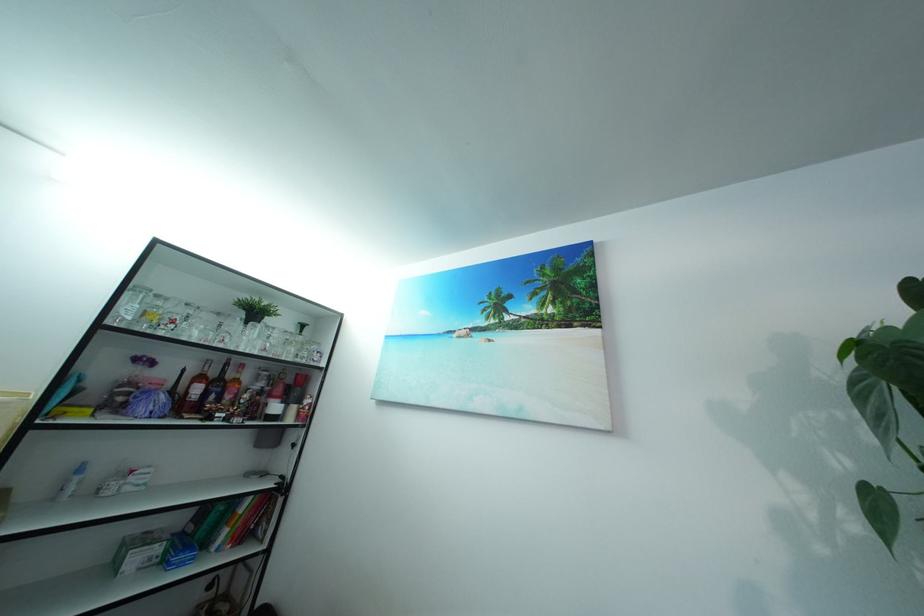
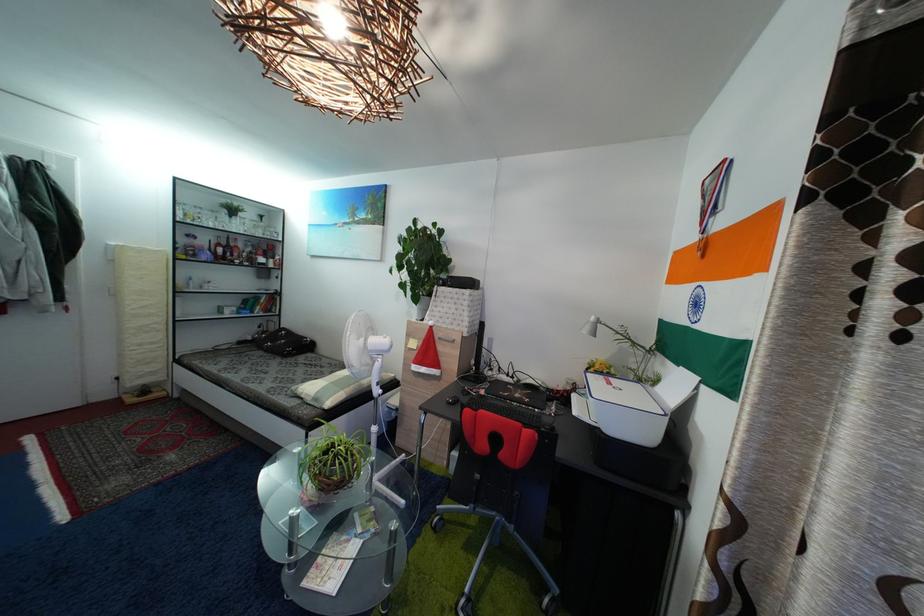
The point at [184,374] is marked in the first image. Where is the corresponding point in the second image?

(213, 246)